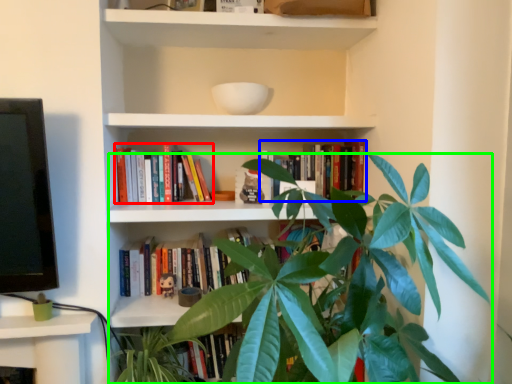
Question: Estimate the real-world distances between objects in this image. Which object is farther from book (highlighted by a red box), book (highlighted by a blue box) or houseplant (highlighted by a green box)?

Choices:
 (A) book
 (B) houseplant

Answer: (B)